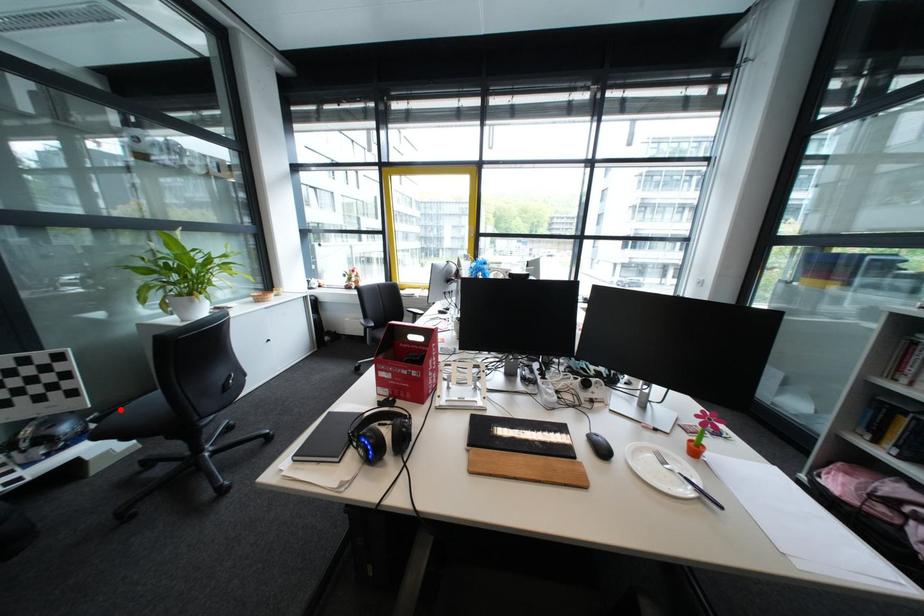
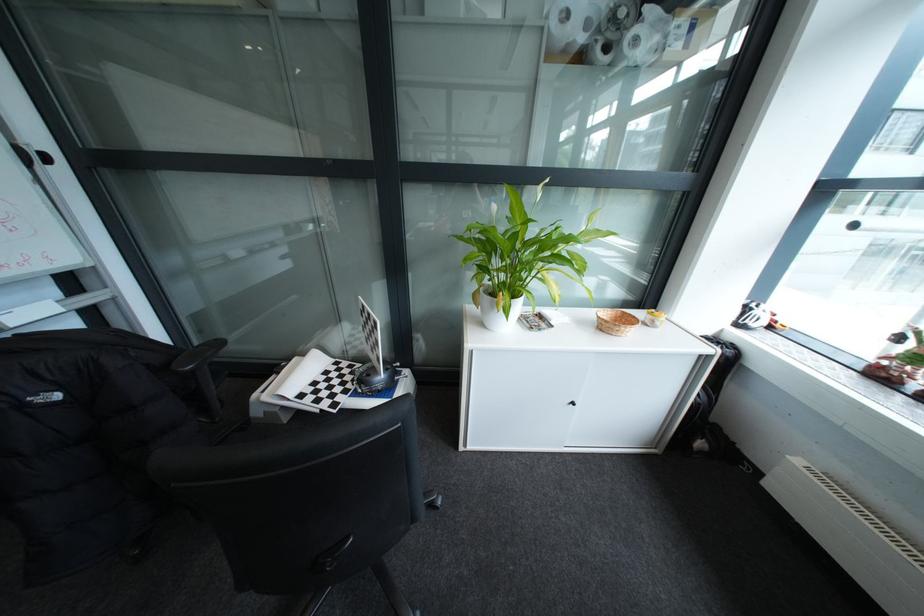
Question: I am providing you with two images of the same scene from different viewpoints. A red point is marked on the first image. Can you still see the location of the red point in image 2?

Choices:
 (A) Yes
 (B) No

Answer: (B)